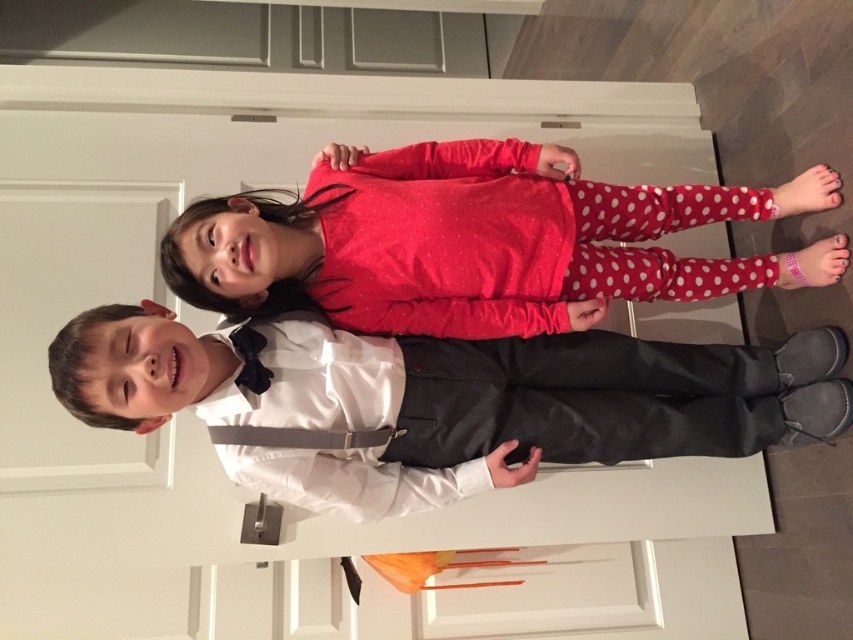
Question: Which object is closer to the camera taking this photo?

Choices:
 (A) white satin shirt at center
 (B) matte red shirt at center

Answer: (A)

Question: Is white satin shirt at center behind matte red shirt at center?

Choices:
 (A) no
 (B) yes

Answer: (A)

Question: Is white satin shirt at center positioned behind matte red shirt at center?

Choices:
 (A) yes
 (B) no

Answer: (B)

Question: Which point is closer to the camera?

Choices:
 (A) matte red shirt at center
 (B) white satin shirt at center

Answer: (B)

Question: Is white satin shirt at center to the right of matte red shirt at center from the viewer's perspective?

Choices:
 (A) no
 (B) yes

Answer: (A)

Question: Which point is closer to the camera?

Choices:
 (A) white satin shirt at center
 (B) matte red shirt at center

Answer: (A)